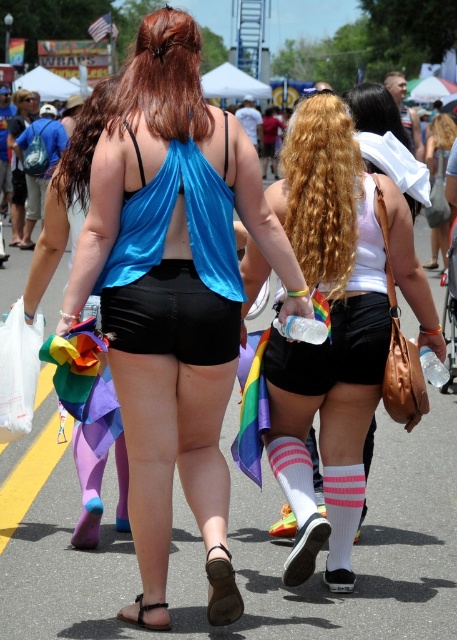
You are a photographer trying to capture a candid shot of the two people in the scene. Since you want to focus on their clothing, you need to know the position of their outfits. Which object is positioned to the left of the other between the white matte tank top at center and the curly blonde hair at upper center?

The white matte tank top at center is to the left of curly blonde hair at upper center.

You are a photographer trying to capture a candid shot of the two people in the scene. You need to ensure that both the white matte tank top at center and the black matte shorts at center are in focus. Given that your camera has a depth of field that can cover 30 inches, will both items be in focus?

The distance between the white matte tank top at center and black matte shorts at center is 29.58 inches, which is within the camera depth of field of 30 inches. Therefore, both items will be in focus.

Based on the photo, you are standing in the crowd at the parade and want to find the white matte tank top at center. Based on the coordinates provided in the description, can you determine its exact position relative to the image frame?

The white matte tank top at center is located exactly at point coordinates 0.512 on the x axis and 0.735 on the y axis within the image frame.